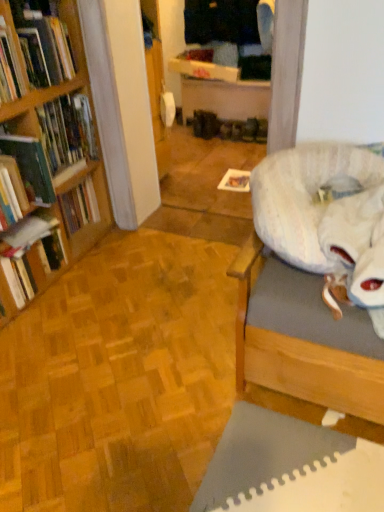
Question: Is wooden bookshelf at left, the 4th book positioned from the bottom, positioned far away from matte brown shoe at center?

Choices:
 (A) no
 (B) yes

Answer: (B)

Question: Can you confirm if wooden bookshelf at left, which is the first book from top to bottom, is wider than matte brown shoe at center?

Choices:
 (A) yes
 (B) no

Answer: (A)

Question: From the image's perspective, does wooden bookshelf at left, which is the first book from top to bottom, appear higher than matte brown shoe at center?

Choices:
 (A) no
 (B) yes

Answer: (A)

Question: Can you confirm if wooden bookshelf at left, the 4th book positioned from the bottom, is positioned to the right of matte brown shoe at center?

Choices:
 (A) yes
 (B) no

Answer: (B)

Question: From the image's perspective, would you say wooden bookshelf at left, which is the first book from top to bottom, is shown under matte brown shoe at center?

Choices:
 (A) no
 (B) yes

Answer: (B)

Question: From a real-world perspective, is wooden bookshelf at left, the 4th book positioned from the bottom, below matte brown shoe at center?

Choices:
 (A) no
 (B) yes

Answer: (A)

Question: Is fluffy white bean bag at right located within hardcover book at left, positioned as the first book in bottom-to-top order?

Choices:
 (A) no
 (B) yes

Answer: (A)

Question: Does hardcover book at left, positioned as the first book in bottom-to-top order, lie in front of fluffy white bean bag at right?

Choices:
 (A) no
 (B) yes

Answer: (A)

Question: Can you confirm if hardcover book at left, positioned as the first book in bottom-to-top order, is bigger than fluffy white bean bag at right?

Choices:
 (A) yes
 (B) no

Answer: (B)

Question: Considering the relative positions of hardcover book at left, positioned as the first book in bottom-to-top order, and fluffy white bean bag at right in the image provided, is hardcover book at left, positioned as the first book in bottom-to-top order, behind fluffy white bean bag at right?

Choices:
 (A) no
 (B) yes

Answer: (B)

Question: Is hardcover book at left, positioned as the first book in bottom-to-top order, thinner than fluffy white bean bag at right?

Choices:
 (A) no
 (B) yes

Answer: (B)

Question: Is hardcover book at left, positioned as the first book in bottom-to-top order, taller than fluffy white bean bag at right?

Choices:
 (A) yes
 (B) no

Answer: (A)

Question: Is hardcover book at left, acting as the fourth book starting from the top, to the right of hardcover book at left, positioned as the second book in bottom-to-top order, from the viewer's perspective?

Choices:
 (A) yes
 (B) no

Answer: (B)